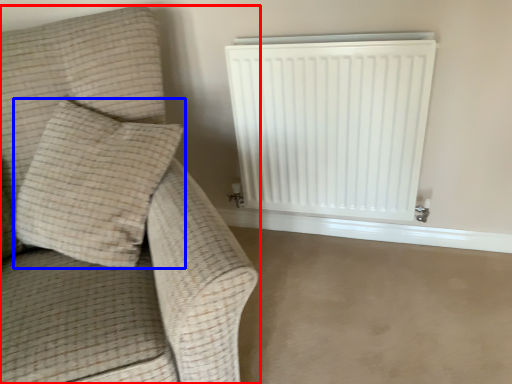
Question: Which object appears closest to the camera in this image, furniture (highlighted by a red box) or pillow (highlighted by a blue box)?

Choices:
 (A) furniture
 (B) pillow

Answer: (A)